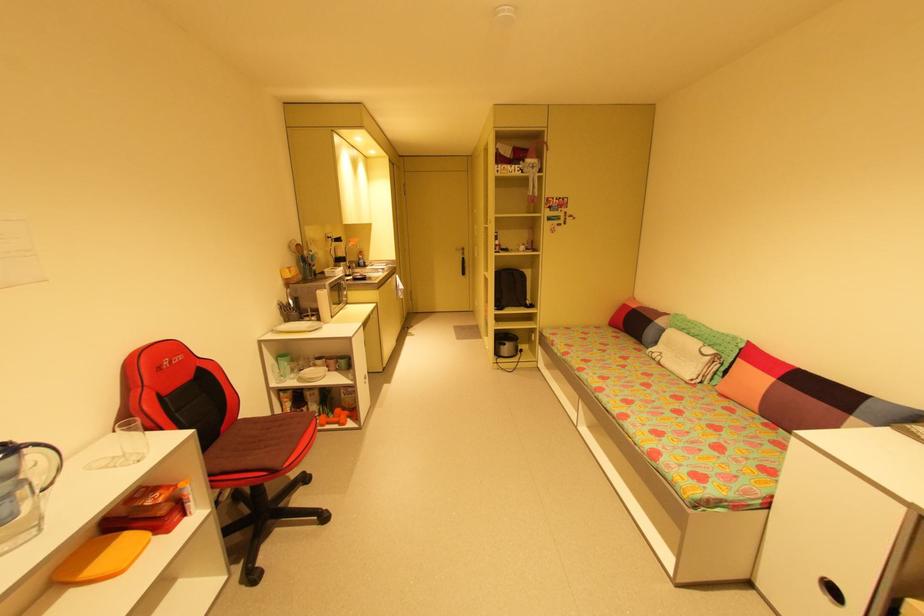
Describe the element at coordinates (311, 374) in the screenshot. This screenshot has width=924, height=616. I see `the white ceramic bowl` at that location.